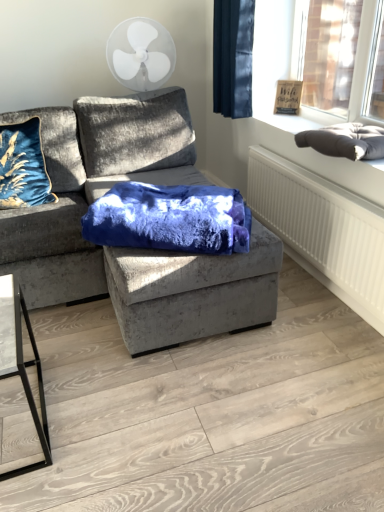
Question: Is velvet gray couch at center aimed at dark gray cushion at upper right?

Choices:
 (A) yes
 (B) no

Answer: (B)

Question: From the image's perspective, is velvet gray couch at center on top of dark gray cushion at upper right?

Choices:
 (A) no
 (B) yes

Answer: (A)

Question: Is velvet gray couch at center positioned behind dark gray cushion at upper right?

Choices:
 (A) yes
 (B) no

Answer: (B)

Question: Does velvet gray couch at center have a greater height compared to dark gray cushion at upper right?

Choices:
 (A) no
 (B) yes

Answer: (B)

Question: From a real-world perspective, is velvet gray couch at center over dark gray cushion at upper right?

Choices:
 (A) yes
 (B) no

Answer: (B)

Question: From a real-world perspective, is velvet gray couch at center physically below dark gray cushion at upper right?

Choices:
 (A) no
 (B) yes

Answer: (B)

Question: Considering the relative sizes of velvet blue pillow at left and white plastic fan at upper center in the image provided, is velvet blue pillow at left bigger than white plastic fan at upper center?

Choices:
 (A) no
 (B) yes

Answer: (A)

Question: From a real-world perspective, does velvet blue pillow at left sit lower than white plastic fan at upper center?

Choices:
 (A) no
 (B) yes

Answer: (B)

Question: Can you confirm if velvet blue pillow at left is taller than white plastic fan at upper center?

Choices:
 (A) yes
 (B) no

Answer: (B)

Question: Is white plastic fan at upper center surrounded by velvet blue pillow at left?

Choices:
 (A) yes
 (B) no

Answer: (B)

Question: From the image's perspective, does velvet blue pillow at left appear higher than white plastic fan at upper center?

Choices:
 (A) no
 (B) yes

Answer: (A)

Question: Is velvet blue pillow at left behind white plastic fan at upper center?

Choices:
 (A) no
 (B) yes

Answer: (A)

Question: Is velvet blue blanket at center with white textured radiator at lower right?

Choices:
 (A) no
 (B) yes

Answer: (A)